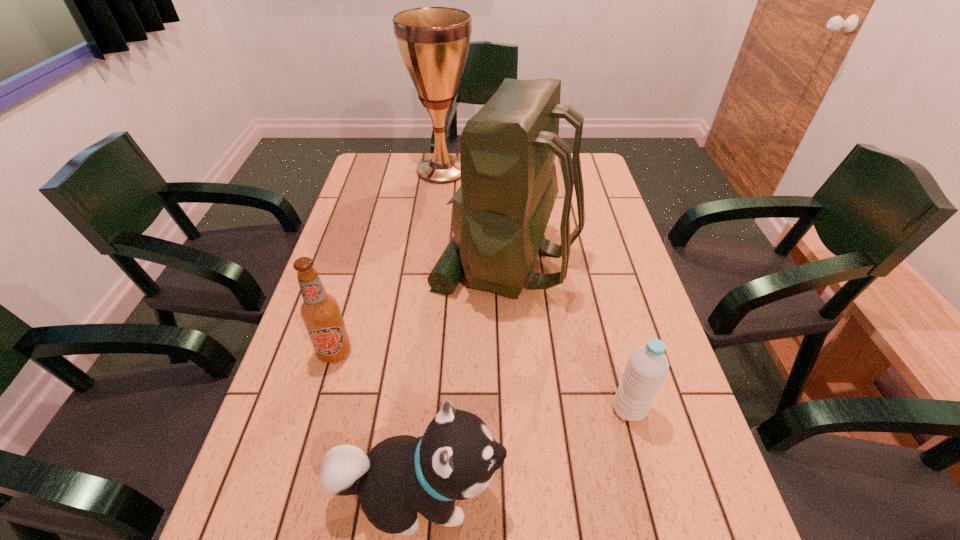
At what (x,y) coordinates should I click in order to perform the action: click on the farthest object. Please return your answer as a coordinate pair (x, y). The height and width of the screenshot is (540, 960). Looking at the image, I should click on (434, 42).

You are a GUI agent. You are given a task and a screenshot of the screen. Output one action in this format:
    pyautogui.click(x=<x>, y=<y>)
    Task: Click on the fourth nearest object
    Image resolution: width=960 pixels, height=540 pixels.
    Given the screenshot: What is the action you would take?
    pyautogui.click(x=509, y=185)

The height and width of the screenshot is (540, 960). In order to click on the leftmost object in this screenshot , I will do `click(320, 312)`.

Find the location of a particular element. the third nearest object is located at coordinates (320, 312).

Identify the location of the second nearest object. point(647,367).

At what (x,y) coordinates should I click in order to perform the action: click on free space located 0.060m on the front of the trophy cup. Please return your answer as a coordinate pair (x, y). Looking at the image, I should click on (439, 197).

The height and width of the screenshot is (540, 960). I want to click on blank space located on the front of the fourth nearest object with visible pockets, so click(374, 261).

At what (x,y) coordinates should I click in order to perform the action: click on vacant space situated 0.140m on the front of the fourth nearest object with visible pockets. Please return your answer as a coordinate pair (x, y). This screenshot has height=540, width=960. Looking at the image, I should click on (384, 261).

Image resolution: width=960 pixels, height=540 pixels. What are the coordinates of `free space located 0.110m on the front of the fourth nearest object with visible pockets` in the screenshot? It's located at (395, 261).

Where is `vacant space positioned 0.160m on the front label of the third nearest object`? Image resolution: width=960 pixels, height=540 pixels. vacant space positioned 0.160m on the front label of the third nearest object is located at coordinates (312, 432).